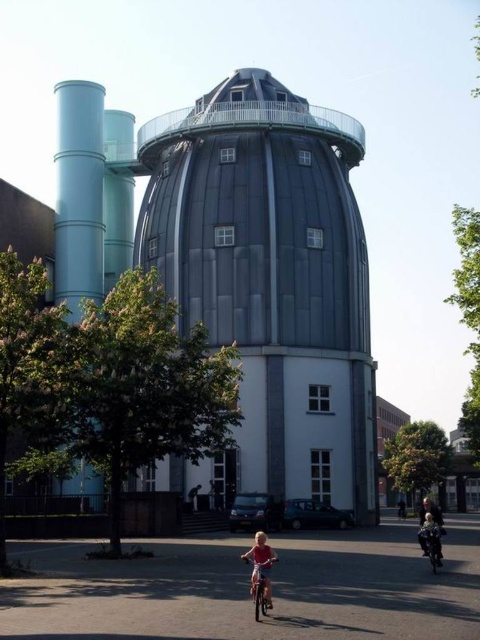
You are trying to decide which clothing item to take with you for a hike. You have a matte pink shirt at lower center and a light blue fabric jacket at lower right. Based on their sizes, which one might be easier to carry in your backpack?

The matte pink shirt at lower center has a lesser width compared to the light blue fabric jacket at lower right, so it might be easier to carry in your backpack.

You are standing at the base of the modernized windmill structure and looking up. There is a point marked at coordinates [254,264] on the structure. What object does this point correspond to?

The point at coordinates [254,264] corresponds to the metallic gray observatory at center.

You are standing at the entrance of the architectural structure and notice the metallic gray observatory at center and the matte pink shirt at lower center. Which object is positioned to the left when viewed from your perspective?

The metallic gray observatory at center is to the left of the matte pink shirt at lower center, so when viewed from your perspective, the metallic gray observatory at center is positioned to the left.